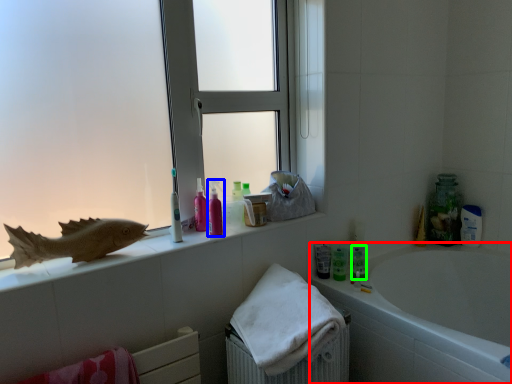
Question: Estimate the real-world distances between objects in this image. Which object is closer to bathtub (highlighted by a red box), mouthwash (highlighted by a blue box) or toiletry (highlighted by a green box)?

Choices:
 (A) mouthwash
 (B) toiletry

Answer: (B)